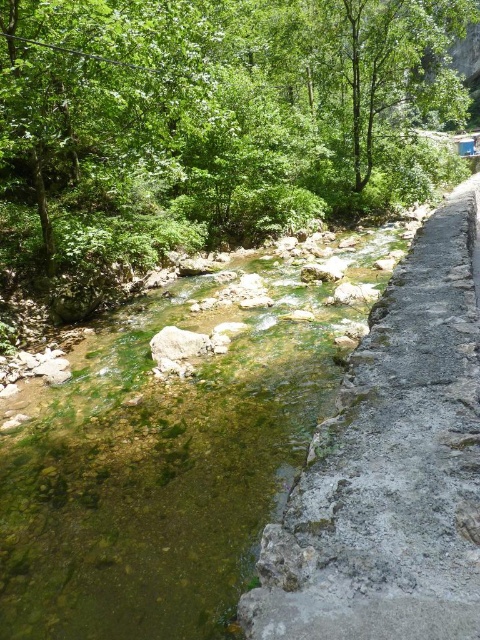
Does clear water at center have a lesser width compared to gray stone path at right?

No.

Image resolution: width=480 pixels, height=640 pixels. Identify the location of clear water at center. (160, 468).